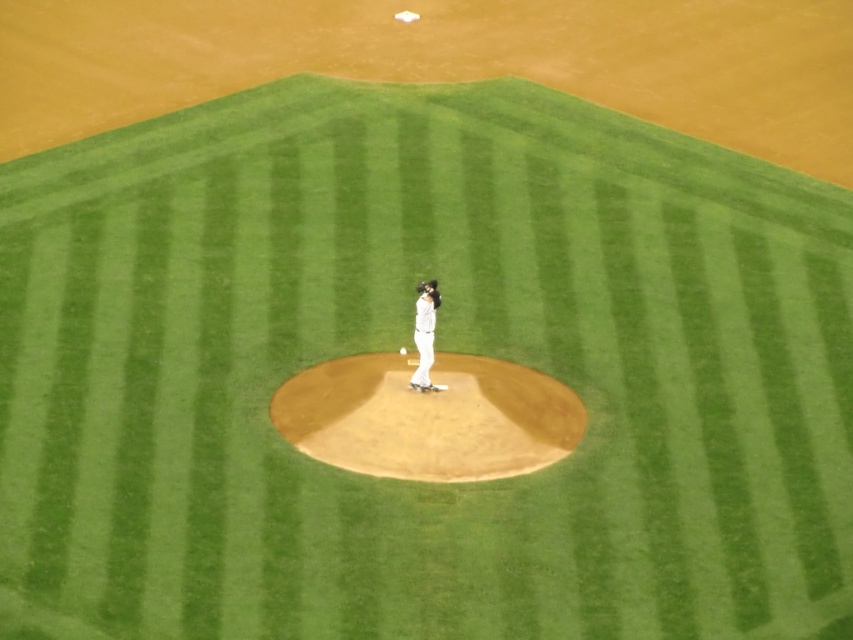
Question: Which object appears farthest from the camera in this image?

Choices:
 (A) dark brown leather glove at center
 (B) white matte baseball pitcher at center
 (C) white matte baseball at center
 (D) brown dirt mound at center

Answer: (C)

Question: Does dark brown leather glove at center appear over white matte baseball at center?

Choices:
 (A) yes
 (B) no

Answer: (A)

Question: Is brown dirt mound at center positioned at the back of white matte baseball at center?

Choices:
 (A) no
 (B) yes

Answer: (A)

Question: Does white matte baseball pitcher at center appear on the right side of dark brown leather glove at center?

Choices:
 (A) yes
 (B) no

Answer: (A)

Question: Which point appears farthest from the camera in this image?

Choices:
 (A) (405, 353)
 (B) (281, 417)

Answer: (A)

Question: Among these objects, which one is farthest from the camera?

Choices:
 (A) white matte baseball pitcher at center
 (B) brown dirt mound at center

Answer: (A)